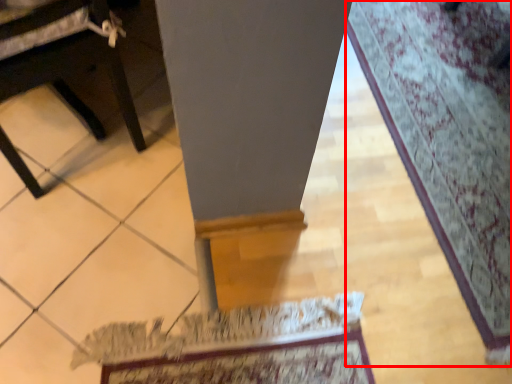
Question: Where is mat (annotated by the red box) located in relation to furniture in the image?

Choices:
 (A) right
 (B) left

Answer: (A)